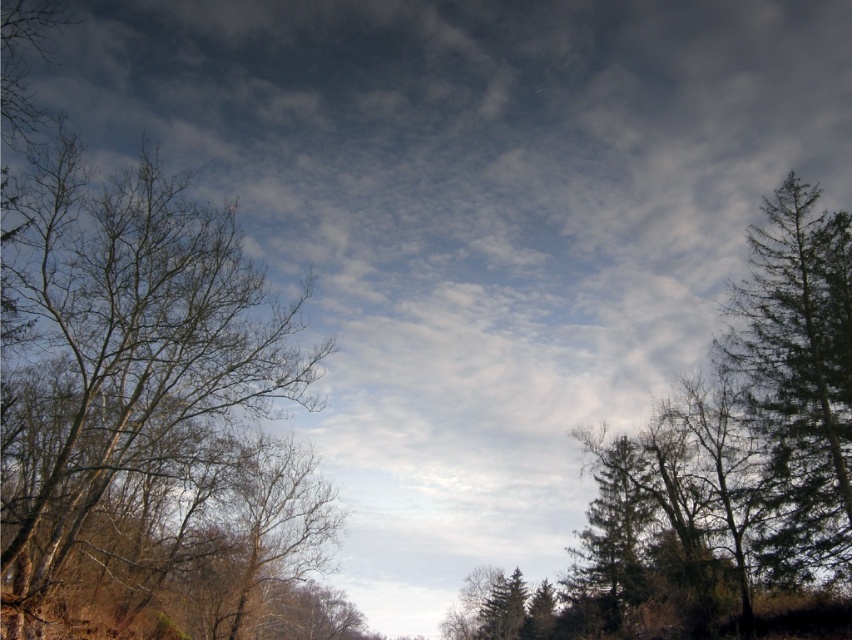
Does brown leafless tree at left have a larger size compared to green textured tree at right?

Indeed, brown leafless tree at left has a larger size compared to green textured tree at right.

Between point (66, 404) and point (804, 349), which one is positioned behind?

The point (804, 349) is more distant.

Who is more distant from viewer, (151, 259) or (829, 227)?

Point (829, 227)

The width and height of the screenshot is (852, 640). What are the coordinates of `brown leafless tree at left` in the screenshot? It's located at (125, 353).